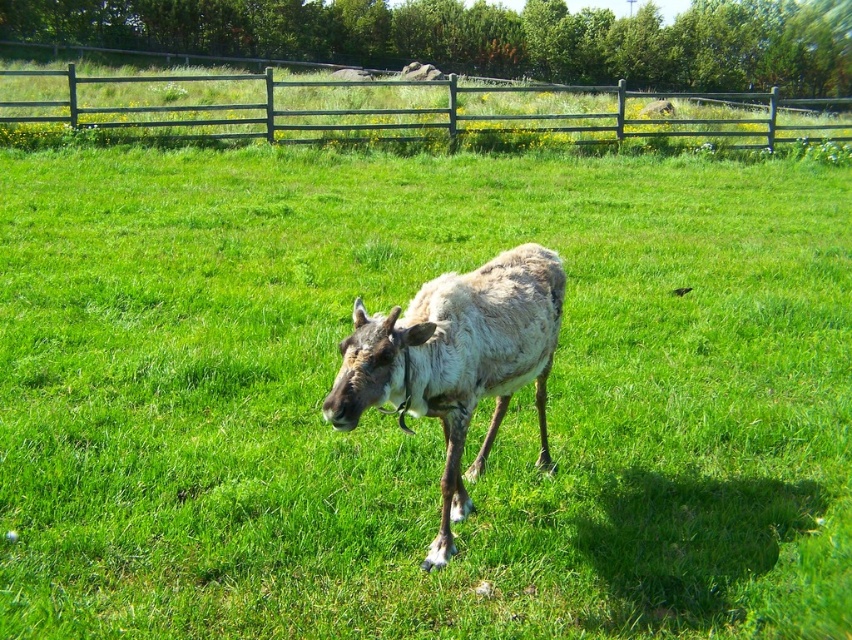
Question: Is wooden fence at upper center positioned behind fuzzy brown reindeer at center?

Choices:
 (A) yes
 (B) no

Answer: (A)

Question: Is wooden fence at upper center to the left of fuzzy brown reindeer at center from the viewer's perspective?

Choices:
 (A) no
 (B) yes

Answer: (A)

Question: Considering the relative positions of wooden fence at upper center and fuzzy brown reindeer at center in the image provided, where is wooden fence at upper center located with respect to fuzzy brown reindeer at center?

Choices:
 (A) above
 (B) below

Answer: (A)

Question: Which point is farther to the camera?

Choices:
 (A) (235, 90)
 (B) (390, 376)

Answer: (A)